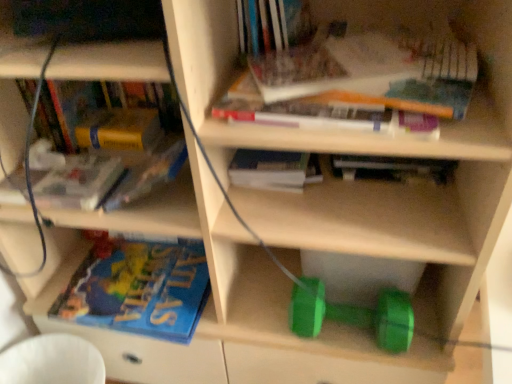
Where is `empty space that is ontop of blue matte book at lower left, placed as the first book when sorted from bottom to top (from a real-world perspective)`? Image resolution: width=512 pixels, height=384 pixels. empty space that is ontop of blue matte book at lower left, placed as the first book when sorted from bottom to top (from a real-world perspective) is located at coordinates (139, 277).